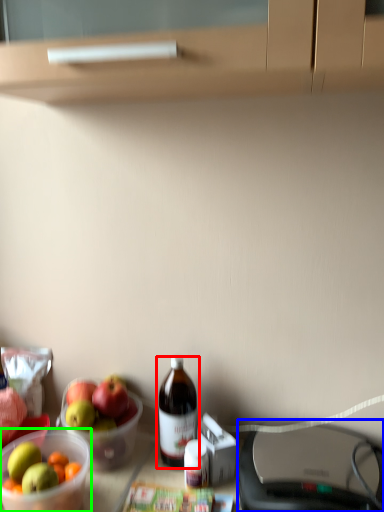
Question: Estimate the real-world distances between objects in this image. Which object is closer to bottle (highlighted by a red box), wide (highlighted by a blue box) or bowl (highlighted by a green box)?

Choices:
 (A) wide
 (B) bowl

Answer: (B)